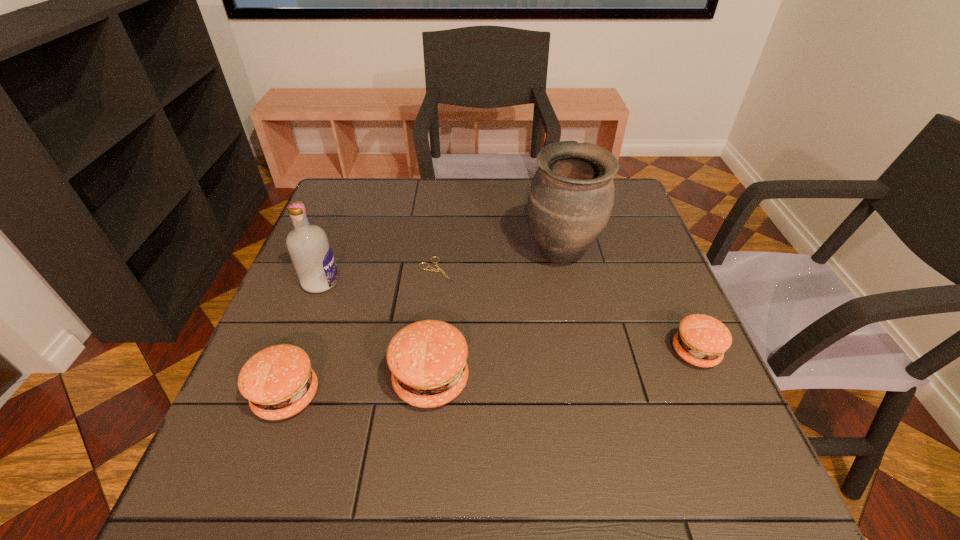
Where is `object that is at the near left corner`? object that is at the near left corner is located at coordinates (278, 381).

Locate an element on the screen. The height and width of the screenshot is (540, 960). vacant space at the far edge of the desktop is located at coordinates (496, 219).

Where is `vacant space at the near edge`? This screenshot has height=540, width=960. vacant space at the near edge is located at coordinates (355, 440).

In the image, there is a desktop. At what (x,y) coordinates should I click in order to perform the action: click on vacant region at the left edge. Please return your answer as a coordinate pair (x, y). Image resolution: width=960 pixels, height=540 pixels. Looking at the image, I should click on (311, 361).

Image resolution: width=960 pixels, height=540 pixels. I want to click on vacant space at the right edge, so click(x=620, y=280).

Find the location of a particular element. vacant space at the near left corner of the desktop is located at coordinates (246, 408).

The height and width of the screenshot is (540, 960). Identify the location of free space at the far right corner of the desktop. (633, 205).

In order to click on vacant position at the near right corner of the desktop in this screenshot , I will do [x=723, y=413].

Identify the location of free area in between the fourth shortest object and the tallest object. (496, 318).

The image size is (960, 540). What are the coordinates of `vacant point located between the tallest object and the vodka` in the screenshot? It's located at (441, 268).